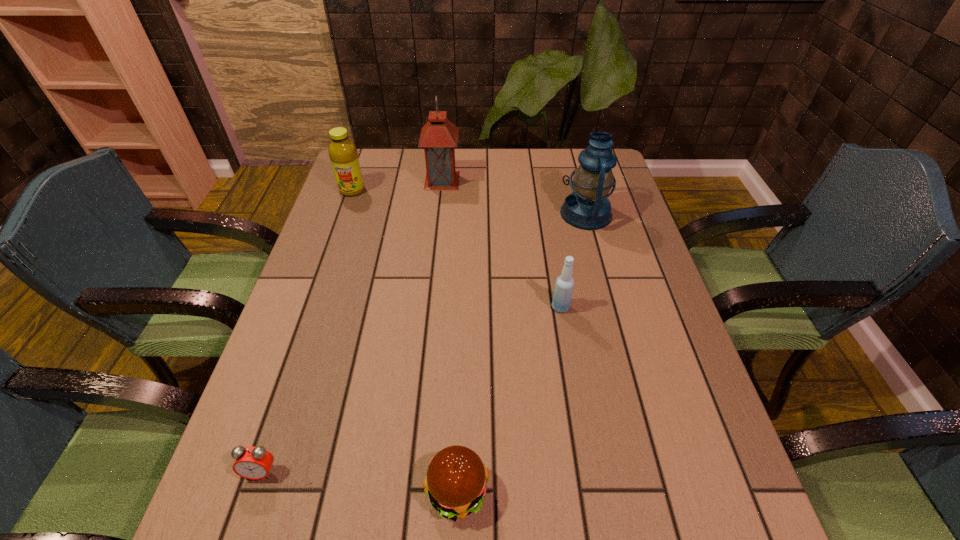
Where is `free space between the shortest object and the rightmost object`? Image resolution: width=960 pixels, height=540 pixels. free space between the shortest object and the rightmost object is located at coordinates (423, 342).

Identify the location of empty location between the hamburger and the rightmost object. This screenshot has height=540, width=960. point(522,352).

In order to click on free spot between the bottle and the shortest object in this screenshot , I will do coord(411,389).

This screenshot has height=540, width=960. In order to click on free spot between the shortest object and the fruit juice in this screenshot , I will do `click(307, 331)`.

What are the coordinates of `vacant space in between the hamburger and the fourth farthest object` in the screenshot? It's located at pos(509,399).

Locate an element on the screen. free space between the fourth shortest object and the farther lantern is located at coordinates (397, 186).

Find the location of a particular element. vacant area that lies between the hamburger and the right lantern is located at coordinates (522, 352).

Identify the location of object that is the fifth nearest to the right lantern. [x=254, y=463].

Identify the location of the fourth closest object to the farther lantern. (456, 479).

The image size is (960, 540). Find the location of `free space that satisfies the following two spatial constraints: 1. on the front label of the fifth object from left to right; 2. on the right side of the fruit juice`. free space that satisfies the following two spatial constraints: 1. on the front label of the fifth object from left to right; 2. on the right side of the fruit juice is located at coordinates (312, 307).